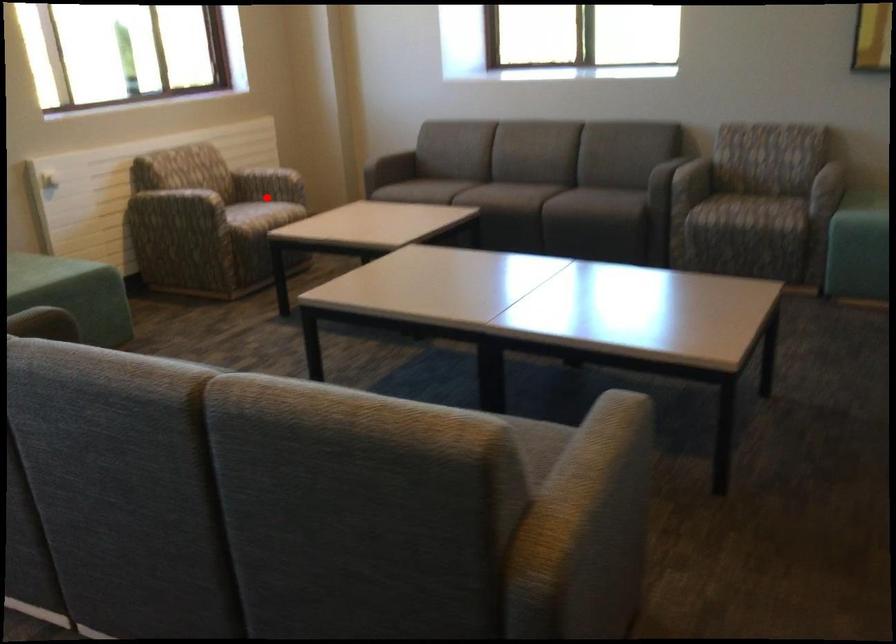
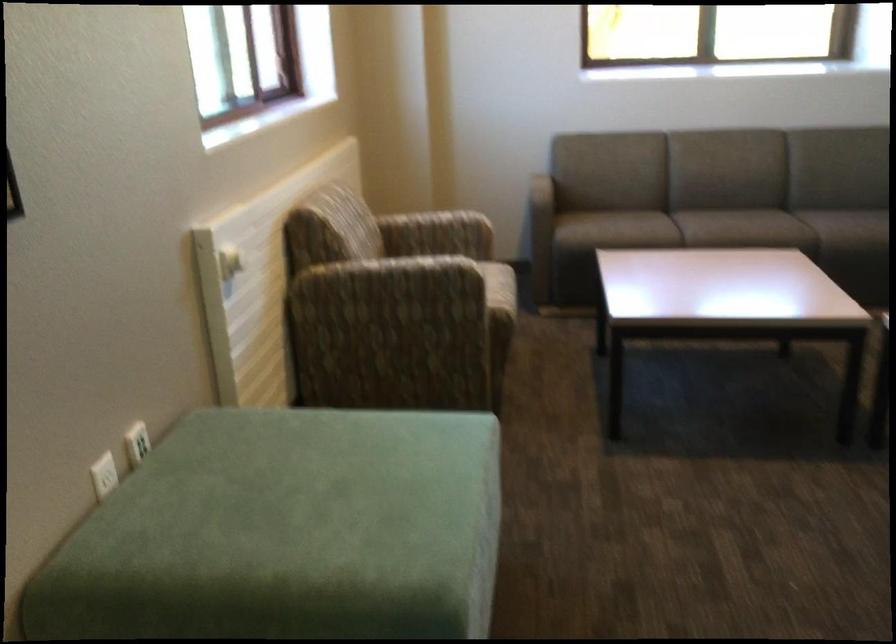
In the second image, find the point that corresponds to the highlighted location in the first image.

(458, 254)